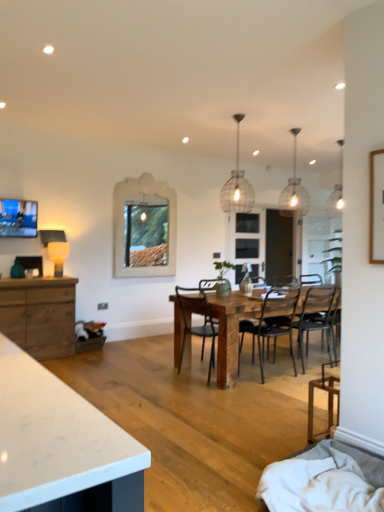
What do you see at coordinates (39, 315) in the screenshot? I see `natural wood cabinet at left` at bounding box center [39, 315].

The height and width of the screenshot is (512, 384). What do you see at coordinates (144, 228) in the screenshot?
I see `white textured mirror at upper center` at bounding box center [144, 228].

The image size is (384, 512). I want to click on woven wire pendant light at center, marked as the third light fixture in a back-to-front arrangement, so click(237, 185).

I want to click on metallic black chair at center, the 3th chair from the back, so click(x=218, y=332).

The height and width of the screenshot is (512, 384). What do you see at coordinates (218, 332) in the screenshot?
I see `metallic black chair at center, the 3th chair from the back` at bounding box center [218, 332].

This screenshot has height=512, width=384. Identify the location of matte glass pendant light at upper right, which is counted as the 3th light fixture, starting from the front. (336, 192).

You are a GUI agent. You are given a task and a screenshot of the screen. Output one action in this format:
    pyautogui.click(x=<x>, y=<y>)
    Task: Click on the natural wood cabinet at left
    
    Given the screenshot: What is the action you would take?
    pyautogui.click(x=39, y=315)

From the image's perspective, does wooden chair at lower right, the 1th chair when ordered from front to back, appear lower than matte glass pendant light at upper right, which is counted as the 3th light fixture, starting from the front?

Yes.

Is wooden chair at lower right, the 4th chair in the back-to-front sequence, completely or partially outside of matte glass pendant light at upper right, positioned as the first light fixture in back-to-front order?

wooden chair at lower right, the 4th chair in the back-to-front sequence, is positioned outside matte glass pendant light at upper right, positioned as the first light fixture in back-to-front order.

Are wooden chair at lower right, the 1th chair when ordered from front to back, and matte glass pendant light at upper right, which is counted as the 3th light fixture, starting from the front, located far from each other?

Yes.

Between wooden chair at lower right, the 1th chair when ordered from front to back, and matte glass pendant light at upper right, which is counted as the 3th light fixture, starting from the front, which one has smaller width?

wooden chair at lower right, the 1th chair when ordered from front to back, is thinner.

I want to click on kitchen & dining room table located underneath the natural wood cabinet at left (from a real-world perspective), so click(230, 331).

Can we say natural wood cabinet at left lies outside rustic wood table at center?

Absolutely, natural wood cabinet at left is external to rustic wood table at center.

Based on the photo, considering their positions, is natural wood cabinet at left located in front of or behind rustic wood table at center?

Clearly, natural wood cabinet at left is behind rustic wood table at center.

Who is smaller, natural wood cabinet at left or rustic wood table at center?

Smaller between the two is natural wood cabinet at left.

Is transparent glass door at center taller or shorter than natural wood cabinet at left?

Considering their sizes, transparent glass door at center has more height than natural wood cabinet at left.

Is transparent glass door at center oriented towards natural wood cabinet at left?

No, transparent glass door at center is not facing towards natural wood cabinet at left.

From a real-world perspective, is matte glass pendant light at upper right, the first light fixture positioned from the right, on top of rustic wood table at center?

Yes, from a real-world perspective, matte glass pendant light at upper right, the first light fixture positioned from the right, is on top of rustic wood table at center.

Looking at this image, considering the relative sizes of matte glass pendant light at upper right, which is the third light fixture from left to right, and rustic wood table at center in the image provided, is matte glass pendant light at upper right, which is the third light fixture from left to right, bigger than rustic wood table at center?

No, matte glass pendant light at upper right, which is the third light fixture from left to right, is not bigger than rustic wood table at center.

You are a GUI agent. You are given a task and a screenshot of the screen. Output one action in this format:
    pyautogui.click(x=<x>, y=<y>)
    Task: Click on the kitchen & dining room table located underneath the matte glass pendant light at upper right, positioned as the first light fixture in back-to-front order (from a real-world perspective)
    Image resolution: width=384 pixels, height=512 pixels.
    Given the screenshot: What is the action you would take?
    pyautogui.click(x=230, y=331)

Which is farther from the camera, [330,196] or [232,346]?

The point [330,196] is farther from the camera.

Between natural wood cabinet at left and metallic black chair at center, the 3th chair from the back, which one has more height?

Standing taller between the two is metallic black chair at center, the 3th chair from the back.

How many degrees apart are the facing directions of natural wood cabinet at left and metallic black chair at center, which appears as the second chair when viewed from the front?

They differ by 91 degrees in their facing directions.

Looking at this image, looking at the image, does natural wood cabinet at left seem bigger or smaller compared to metallic black chair at center, which appears as the second chair when viewed from the front?

Considering their sizes, natural wood cabinet at left takes up more space than metallic black chair at center, which appears as the second chair when viewed from the front.

Is natural wood cabinet at left closer to the viewer compared to metallic black chair at center, the 3th chair from the back?

No, it is not.

Between woven wire pendant light at center, marked as the third light fixture in a back-to-front arrangement, and metallic black chair at center, which appears as the second chair when viewed from the front, which one is positioned behind?

woven wire pendant light at center, marked as the third light fixture in a back-to-front arrangement, is more distant.

There is a woven wire pendant light at center, marked as the third light fixture in a back-to-front arrangement. In order to click on the 1st chair below it (from a real-world perspective) in this screenshot , I will do `click(218, 332)`.

How many degrees apart are the facing directions of woven wire pendant light at center, which is the 1th light fixture in front-to-back order, and metallic black chair at center, the 3th chair from the back?

4.83 degrees separate the facing orientations of woven wire pendant light at center, which is the 1th light fixture in front-to-back order, and metallic black chair at center, the 3th chair from the back.

Is woven wire pendant light at center, which ranks as the 3th light fixture in right-to-left order, not near metallic black chair at center, the 3th chair from the back?

Yes, woven wire pendant light at center, which ranks as the 3th light fixture in right-to-left order, and metallic black chair at center, the 3th chair from the back, are quite far apart.

How many degrees apart are the facing directions of black metal chair at center, which ranks as the 4th chair in front-to-back order, and metallic black chair at center, the 3th chair from the back?

black metal chair at center, which ranks as the 4th chair in front-to-back order, and metallic black chair at center, the 3th chair from the back, are facing 87.2 degrees away from each other.

Which of these two, black metal chair at center, which ranks as the 4th chair in front-to-back order, or metallic black chair at center, which appears as the second chair when viewed from the front, is wider?

With larger width is metallic black chair at center, which appears as the second chair when viewed from the front.

Considering the relative positions of black metal chair at center, which ranks as the 4th chair in front-to-back order, and metallic black chair at center, the 3th chair from the back, in the image provided, is black metal chair at center, which ranks as the 4th chair in front-to-back order, to the right of metallic black chair at center, the 3th chair from the back, from the viewer's perspective?

Yes.

The height and width of the screenshot is (512, 384). Find the location of `the 4th chair in front of the matte glass pendant light at upper right, positioned as the first light fixture in back-to-front order`. the 4th chair in front of the matte glass pendant light at upper right, positioned as the first light fixture in back-to-front order is located at coordinates (328, 401).

Where is `cabinetry above the rustic wood table at center (from the image's perspective)`? This screenshot has width=384, height=512. cabinetry above the rustic wood table at center (from the image's perspective) is located at coordinates (39, 315).

Estimate the real-world distances between objects in this image. Which object is further from metallic black chair at center, the 3th chair from the back, rustic wood table at center or black metal chair at center, which is the 1th chair from back to front?

black metal chair at center, which is the 1th chair from back to front, lies further to metallic black chair at center, the 3th chair from the back, than the other object.

Considering their positions, is transparent glass door at center positioned further to metallic black chair at center, the 3th chair from the back, than woven wire pendant light at center, which is the 1th light fixture in front-to-back order?

Among the two, transparent glass door at center is located further to metallic black chair at center, the 3th chair from the back.

Estimate the real-world distances between objects in this image. Which object is closer to transparent glass door at center, black metal chair at center, which appears as the 3th chair when viewed from the front, or matte glass pendant light at upper right, the first light fixture positioned from the right?

matte glass pendant light at upper right, the first light fixture positioned from the right, lies closer to transparent glass door at center than the other object.

Based on their spatial positions, is matte white lampshade at left or black metal chair at center, which appears as the 3th chair when viewed from the front, closer to matte glass pendant light at upper right, positioned as the first light fixture in back-to-front order?

Among the two, black metal chair at center, which appears as the 3th chair when viewed from the front, is located nearer to matte glass pendant light at upper right, positioned as the first light fixture in back-to-front order.

Estimate the real-world distances between objects in this image. Which object is closer to wooden chair at lower right, the 1th chair when ordered from front to back, matte white lampshade at left or black metal chair at center, which appears as the 3th chair when viewed from the front?

Among the two, black metal chair at center, which appears as the 3th chair when viewed from the front, is located nearer to wooden chair at lower right, the 1th chair when ordered from front to back.

Looking at the image, which one is located closer to rustic wood table at center, matte white lampshade at left or black metal chair at center, which is the 1th chair from back to front?

black metal chair at center, which is the 1th chair from back to front.

Estimate the real-world distances between objects in this image. Which object is further from black metal chair at center, which ranks as the 4th chair in front-to-back order, white textured mirror at upper center or matte white lampshade at left?

matte white lampshade at left.

Which object lies further to the anchor point white textured mirror at upper center, woven wood pendant light at upper center, the second light fixture in the back-to-front sequence, or natural wood cabinet at left?

The object further to white textured mirror at upper center is woven wood pendant light at upper center, the second light fixture in the back-to-front sequence.

Identify the location of chair that lies between matte glass pendant light at upper right, the first light fixture positioned from the right, and black metal chair at center, which ranks as the 4th chair in front-to-back order, from top to bottom. This screenshot has width=384, height=512. (218, 332).

The width and height of the screenshot is (384, 512). Identify the location of window located between natural wood cabinet at left and woven wire pendant light at center, which ranks as the 3th light fixture in right-to-left order, in the left-right direction. (144, 228).

Where is `window situated between natural wood cabinet at left and woven wood pendant light at upper center, which appears as the 2th light fixture when viewed from the front, from left to right`? window situated between natural wood cabinet at left and woven wood pendant light at upper center, which appears as the 2th light fixture when viewed from the front, from left to right is located at coordinates (144, 228).

Identify the location of light fixture between woven wood pendant light at upper center, the second light fixture in the back-to-front sequence, and metallic black chair at center, which appears as the second chair when viewed from the front, in the vertical direction. The image size is (384, 512). (237, 185).